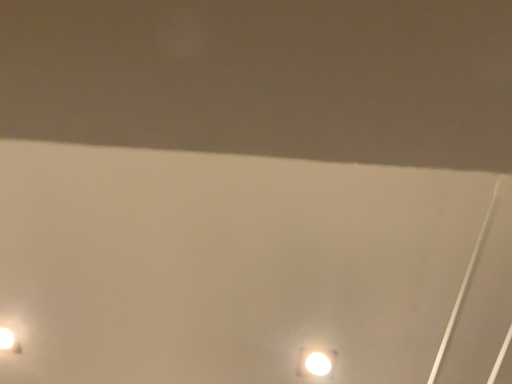
The width and height of the screenshot is (512, 384). I want to click on white glossy light bulb at lower right, so click(315, 362).

This screenshot has height=384, width=512. What do you see at coordinates (315, 362) in the screenshot? I see `white glossy light bulb at lower right` at bounding box center [315, 362].

This screenshot has width=512, height=384. In order to click on white glossy light bulb at lower right in this screenshot , I will do `click(315, 362)`.